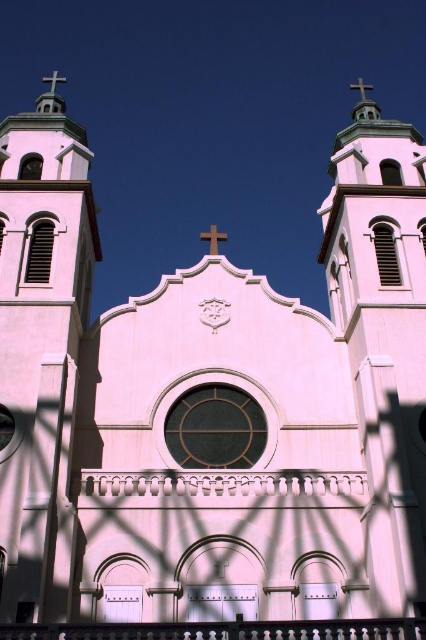
Does white stone cross at left have a smaller size compared to white stone tower at upper right?

Result: No, white stone cross at left is not smaller than white stone tower at upper right.

Between white stone cross at left and white stone tower at upper right, which one is positioned higher?

Positioned higher is white stone cross at left.

Locate an element on the screen. The image size is (426, 640). white stone cross at left is located at coordinates (40, 348).